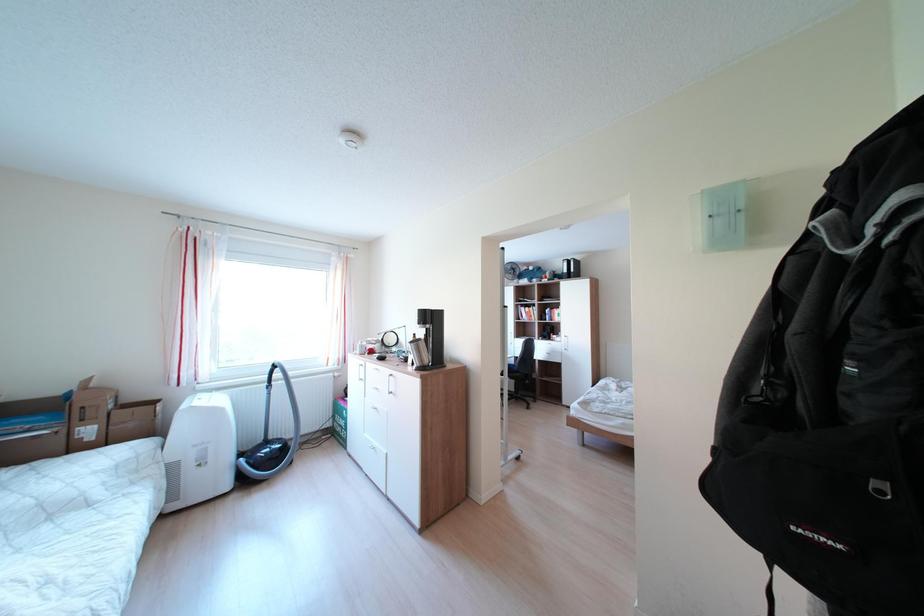
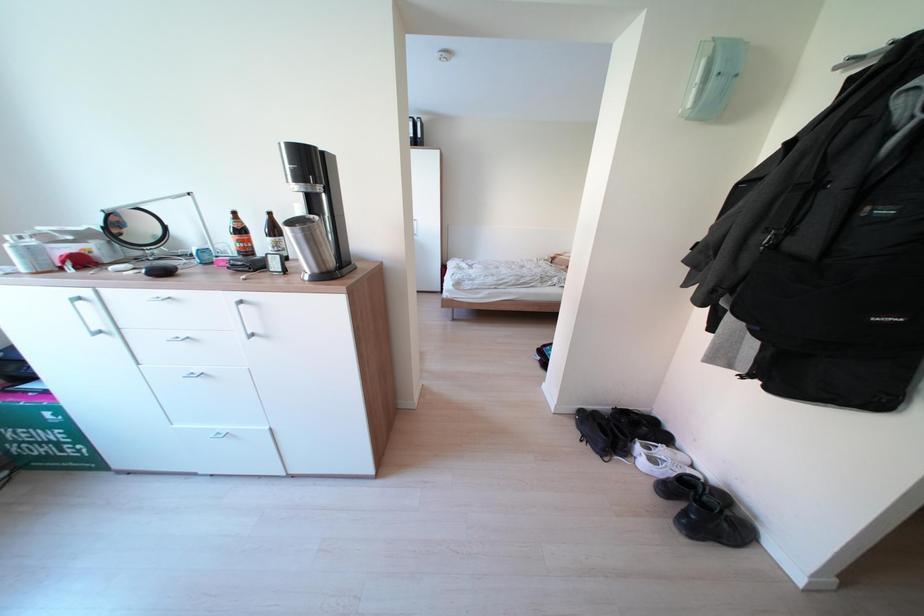
How did the camera likely rotate?

The camera's rotation is toward right-down.